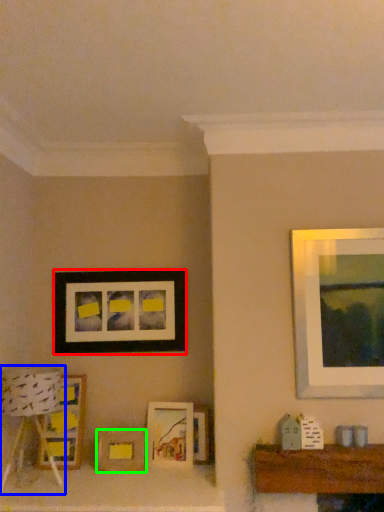
Question: Which is nearer to the picture frame (highlighted by a red box)? lamp (highlighted by a blue box) or picture frame (highlighted by a green box).

Choices:
 (A) lamp
 (B) picture frame

Answer: (A)